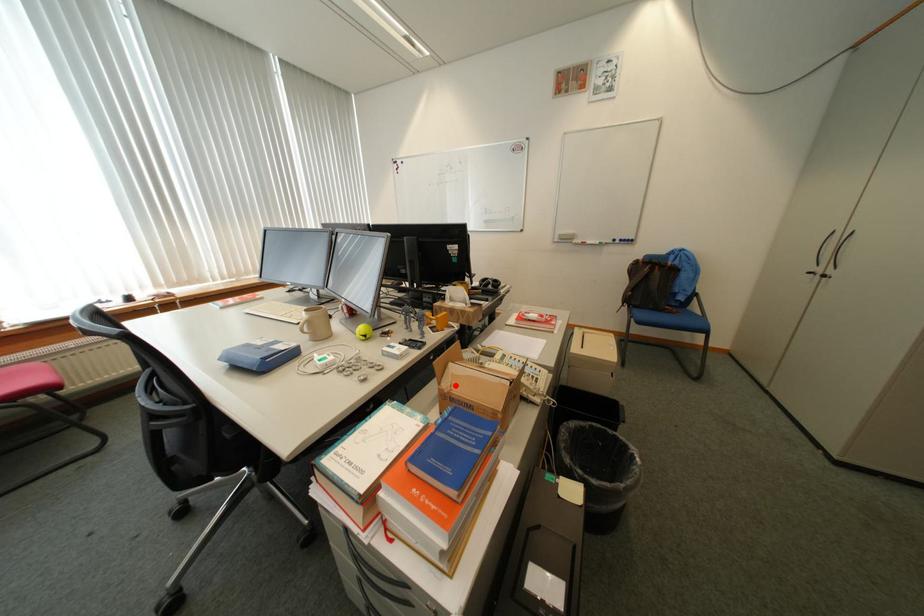
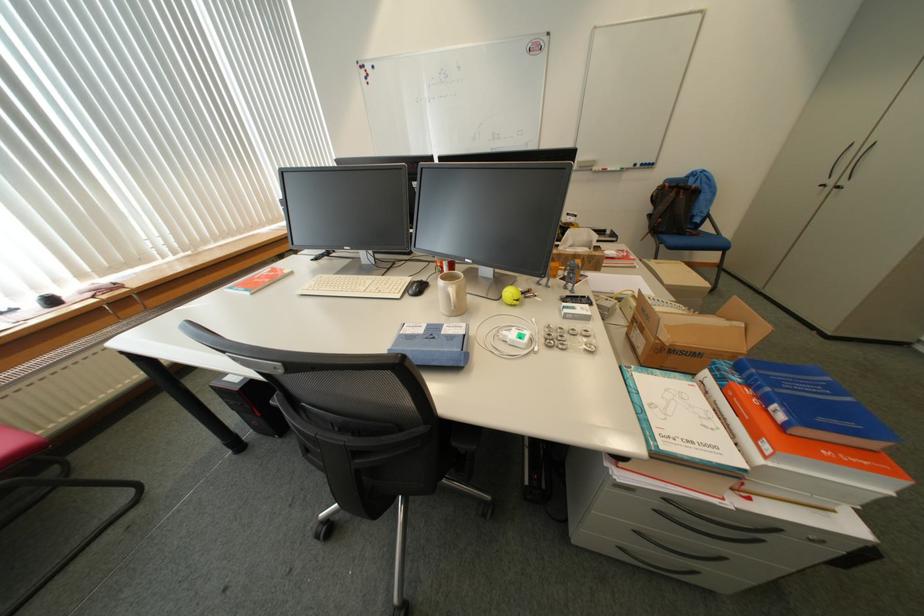
The point at the highlighted location is marked in the first image. Where is the corresponding point in the second image?

(675, 339)